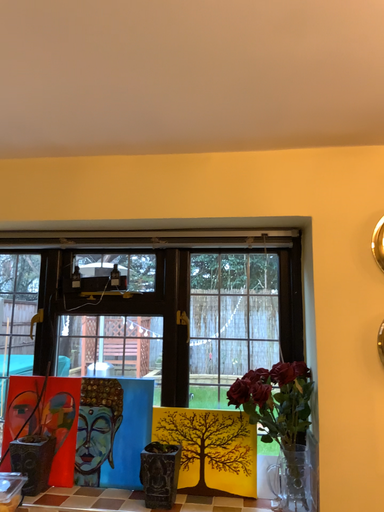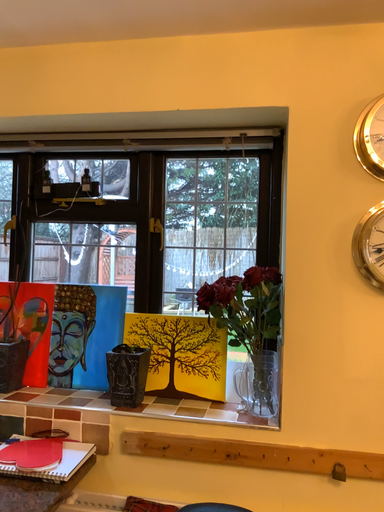
Question: How did the camera likely rotate when shooting the video?

Choices:
 (A) rotated upward
 (B) rotated downward

Answer: (B)